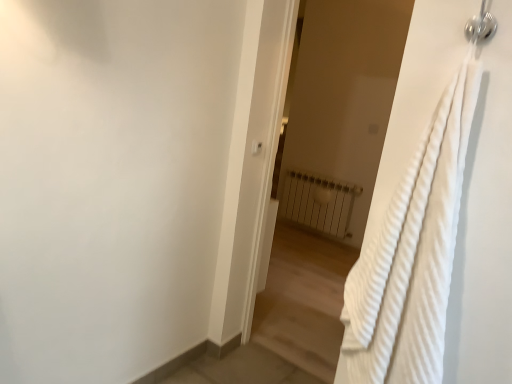
Question: Does point (434, 233) appear closer or farther from the camera than point (251, 152)?

Choices:
 (A) closer
 (B) farther

Answer: (A)

Question: From a real-world perspective, is white textured towel at right above or below white plastic light switch at upper center?

Choices:
 (A) above
 (B) below

Answer: (B)

Question: Which object is positioned closest to the white textured towel at right?

Choices:
 (A) white plastic light switch at upper center
 (B) white metallic radiator at center
 (C) white textured towel at right

Answer: (A)

Question: Which object is the farthest from the white plastic light switch at upper center?

Choices:
 (A) white textured towel at right
 (B) white metallic radiator at center
 (C) white textured towel at right

Answer: (B)